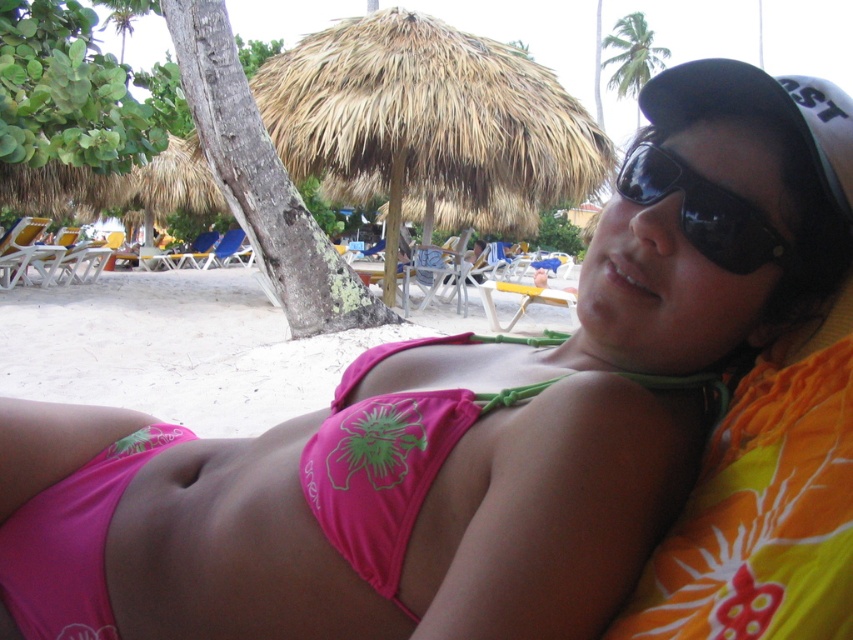
Can you confirm if pink fabric bikini top at center is smaller than black plastic sunglasses at upper right?

No.

The height and width of the screenshot is (640, 853). Find the location of `pink fabric bikini top at center`. pink fabric bikini top at center is located at coordinates (392, 458).

Who is more forward, (409, 461) or (643, 180)?

Point (409, 461) is in front.

Identify the location of pink fabric bikini top at center. This screenshot has width=853, height=640. (392, 458).